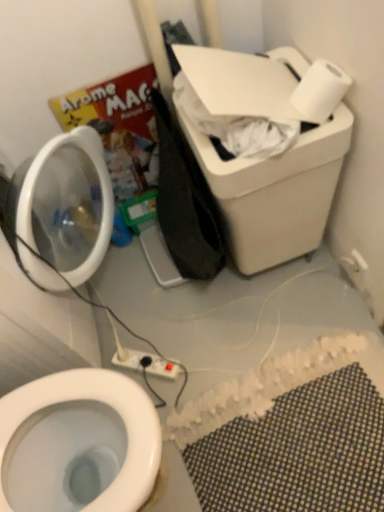
Where is `white mesh bath mat at lower right`? white mesh bath mat at lower right is located at coordinates (298, 452).

What do you see at coordinates (298, 452) in the screenshot? I see `white mesh bath mat at lower right` at bounding box center [298, 452].

I want to click on white plastic power strip at lower center, the 2th electric outlet when ordered from right to left, so click(146, 362).

The height and width of the screenshot is (512, 384). Describe the element at coordinates (358, 261) in the screenshot. I see `white plastic electric outlet at upper right, the first electric outlet in the right-to-left sequence` at that location.

Find the location of `translucent plastic container at left`. translucent plastic container at left is located at coordinates (67, 201).

Which of these two, white plastic electric outlet at upper right, marked as the 2th electric outlet in a bottom-to-top arrangement, or white plastic power strip at lower center, the 2th electric outlet when ordered from right to left, is thinner?

white plastic electric outlet at upper right, marked as the 2th electric outlet in a bottom-to-top arrangement, is thinner.

Would you say white plastic electric outlet at upper right, which is the second electric outlet in left-to-right order, is a long distance from white plastic power strip at lower center, acting as the 2th electric outlet starting from the top?

white plastic electric outlet at upper right, which is the second electric outlet in left-to-right order, is near white plastic power strip at lower center, acting as the 2th electric outlet starting from the top, not far away.

Does white plastic electric outlet at upper right, the first electric outlet in the right-to-left sequence, have a greater height compared to white plastic power strip at lower center, arranged as the first electric outlet when ordered from the bottom?

Indeed, white plastic electric outlet at upper right, the first electric outlet in the right-to-left sequence, has a greater height compared to white plastic power strip at lower center, arranged as the first electric outlet when ordered from the bottom.

Which is behind, white plastic electric outlet at upper right, the first electric outlet in the right-to-left sequence, or white plastic power strip at lower center, the 2th electric outlet when ordered from right to left?

Positioned behind is white plastic power strip at lower center, the 2th electric outlet when ordered from right to left.

Is translucent plastic container at left in contact with white plastic power strip at lower center, arranged as the first electric outlet when viewed from the left?

translucent plastic container at left is not next to white plastic power strip at lower center, arranged as the first electric outlet when viewed from the left, and they're not touching.

Considering the sizes of translucent plastic container at left and white plastic power strip at lower center, acting as the 2th electric outlet starting from the top, in the image, is translucent plastic container at left wider or thinner than white plastic power strip at lower center, acting as the 2th electric outlet starting from the top,?

Clearly, translucent plastic container at left has more width compared to white plastic power strip at lower center, acting as the 2th electric outlet starting from the top.

Is translucent plastic container at left surrounding white plastic power strip at lower center, arranged as the first electric outlet when viewed from the left?

No, white plastic power strip at lower center, arranged as the first electric outlet when viewed from the left, is not surrounded by translucent plastic container at left.

Is point (79, 148) closer to camera compared to point (130, 357)?

Yes, point (79, 148) is in front of point (130, 357).

Can you confirm if translucent plastic container at left is smaller than white plastic electric outlet at upper right, which is the second electric outlet in left-to-right order?

Actually, translucent plastic container at left might be larger than white plastic electric outlet at upper right, which is the second electric outlet in left-to-right order.

Considering the sizes of objects translucent plastic container at left and white plastic electric outlet at upper right, marked as the 2th electric outlet in a bottom-to-top arrangement, in the image provided, who is thinner, translucent plastic container at left or white plastic electric outlet at upper right, marked as the 2th electric outlet in a bottom-to-top arrangement,?

With smaller width is white plastic electric outlet at upper right, marked as the 2th electric outlet in a bottom-to-top arrangement.

From the image's perspective, is translucent plastic container at left above or below white plastic electric outlet at upper right, placed as the first electric outlet when sorted from top to bottom?

translucent plastic container at left is situated higher than white plastic electric outlet at upper right, placed as the first electric outlet when sorted from top to bottom, in the image.

Could you tell me if translucent plastic container at left is facing white plastic electric outlet at upper right, marked as the 2th electric outlet in a bottom-to-top arrangement?

Yes, translucent plastic container at left is oriented towards white plastic electric outlet at upper right, marked as the 2th electric outlet in a bottom-to-top arrangement.

In order to click on the 1st electric outlet below when counting from the white matte toilet paper at upper right (from the image's perspective) in this screenshot , I will do point(358,261).

Is white matte toilet paper at upper right positioned behind white plastic electric outlet at upper right, placed as the first electric outlet when sorted from top to bottom?

No, it is in front of white plastic electric outlet at upper right, placed as the first electric outlet when sorted from top to bottom.

Which is more distant, (330, 66) or (355, 267)?

The point (355, 267) is behind.

Does white matte toilet paper at upper right have a lesser height compared to white plastic electric outlet at upper right, which is the second electric outlet in left-to-right order?

No, white matte toilet paper at upper right is not shorter than white plastic electric outlet at upper right, which is the second electric outlet in left-to-right order.

Is there a large distance between white mesh bath mat at lower right and translucent plastic container at left?

Actually, white mesh bath mat at lower right and translucent plastic container at left are a little close together.

What's the angular difference between white mesh bath mat at lower right and translucent plastic container at left's facing directions?

The facing directions of white mesh bath mat at lower right and translucent plastic container at left are 1.12 degrees apart.

Looking at their sizes, would you say white mesh bath mat at lower right is wider or thinner than translucent plastic container at left?

Considering their sizes, white mesh bath mat at lower right looks broader than translucent plastic container at left.

The image size is (384, 512). What are the coordinates of `bath mat lying on the right of translucent plastic container at left` in the screenshot? It's located at (298, 452).

Which of these two, white plastic power strip at lower center, arranged as the first electric outlet when viewed from the left, or white mesh bath mat at lower right, is smaller?

white plastic power strip at lower center, arranged as the first electric outlet when viewed from the left.

From the image's perspective, who appears lower, white plastic power strip at lower center, arranged as the first electric outlet when viewed from the left, or white mesh bath mat at lower right?

white mesh bath mat at lower right appears lower in the image.

Based on the photo, how far apart are white plastic power strip at lower center, arranged as the first electric outlet when ordered from the bottom, and white mesh bath mat at lower right?

A distance of 16.17 inches exists between white plastic power strip at lower center, arranged as the first electric outlet when ordered from the bottom, and white mesh bath mat at lower right.

Is white plastic power strip at lower center, arranged as the first electric outlet when viewed from the left, next to white mesh bath mat at lower right and touching it?

No, white plastic power strip at lower center, arranged as the first electric outlet when viewed from the left, is not next to white mesh bath mat at lower right.

Which is in front, white matte toilet paper at upper right or white mesh bath mat at lower right?

white matte toilet paper at upper right is closer to the camera.

Which is more to the left, white matte toilet paper at upper right or white mesh bath mat at lower right?

Positioned to the left is white mesh bath mat at lower right.

From a real-world perspective, is white matte toilet paper at upper right above or below white mesh bath mat at lower right?

Clearly, from a real-world perspective, white matte toilet paper at upper right is above white mesh bath mat at lower right.

Which object is wider, white matte toilet paper at upper right or white mesh bath mat at lower right?

white mesh bath mat at lower right.

The image size is (384, 512). I want to click on electric outlet that appears on the left of white plastic electric outlet at upper right, which is the second electric outlet in left-to-right order, so click(146, 362).

Find the location of `the 2nd electric outlet behind the translucent plastic container at left, counting from the anchor's position`. the 2nd electric outlet behind the translucent plastic container at left, counting from the anchor's position is located at coordinates (146, 362).

Looking at the image, which one is located further to white matte toilet paper at upper right, white mesh bath mat at lower right or translucent plastic container at left?

white mesh bath mat at lower right.

Based on their spatial positions, is white plastic electric outlet at upper right, the first electric outlet in the right-to-left sequence, or white matte toilet paper at upper right closer to translucent plastic container at left?

white matte toilet paper at upper right is positioned closer to the anchor translucent plastic container at left.

Which object lies further to the anchor point white mesh bath mat at lower right, white matte toilet paper at upper right or white plastic electric outlet at upper right, placed as the first electric outlet when sorted from top to bottom?

white matte toilet paper at upper right is further to white mesh bath mat at lower right.

From the image, which object appears to be nearer to white mesh bath mat at lower right, translucent plastic container at left or white plastic electric outlet at upper right, the first electric outlet in the right-to-left sequence?

Based on the image, white plastic electric outlet at upper right, the first electric outlet in the right-to-left sequence, appears to be nearer to white mesh bath mat at lower right.

Considering their positions, is white plastic power strip at lower center, the 2th electric outlet when ordered from right to left, positioned further to white plastic electric outlet at upper right, marked as the 2th electric outlet in a bottom-to-top arrangement, than white mesh bath mat at lower right?

white plastic power strip at lower center, the 2th electric outlet when ordered from right to left, is further to white plastic electric outlet at upper right, marked as the 2th electric outlet in a bottom-to-top arrangement.

Based on their spatial positions, is white plastic power strip at lower center, arranged as the first electric outlet when ordered from the bottom, or translucent plastic container at left closer to white mesh bath mat at lower right?

Among the two, white plastic power strip at lower center, arranged as the first electric outlet when ordered from the bottom, is located nearer to white mesh bath mat at lower right.

Considering their positions, is white matte toilet paper at upper right positioned closer to translucent plastic container at left than white plastic power strip at lower center, the 2th electric outlet when ordered from right to left?

white plastic power strip at lower center, the 2th electric outlet when ordered from right to left, lies closer to translucent plastic container at left than the other object.

From the image, which object appears to be nearer to translucent plastic container at left, white plastic power strip at lower center, acting as the 2th electric outlet starting from the top, or white matte toilet paper at upper right?

white plastic power strip at lower center, acting as the 2th electric outlet starting from the top, lies closer to translucent plastic container at left than the other object.

Identify the location of electric outlet situated between translucent plastic container at left and white mesh bath mat at lower right from left to right. The height and width of the screenshot is (512, 384). (146, 362).

Identify the location of electric outlet between white matte toilet paper at upper right and white plastic power strip at lower center, arranged as the first electric outlet when viewed from the left, vertically. The height and width of the screenshot is (512, 384). (358, 261).

This screenshot has height=512, width=384. Find the location of `toilet paper between translucent plastic container at left and white plastic electric outlet at upper right, the first electric outlet in the right-to-left sequence, in the horizontal direction`. toilet paper between translucent plastic container at left and white plastic electric outlet at upper right, the first electric outlet in the right-to-left sequence, in the horizontal direction is located at coordinates (320, 91).

This screenshot has height=512, width=384. In order to click on bath mat between translucent plastic container at left and white plastic electric outlet at upper right, which is the second electric outlet in left-to-right order in this screenshot , I will do `click(298, 452)`.